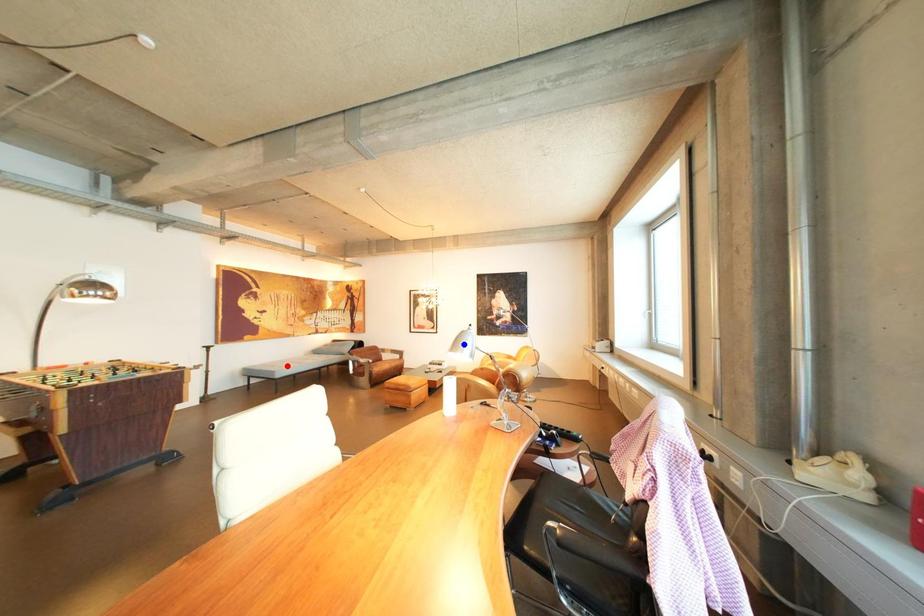
Question: In the image, two points are highlighted. Which point is nearer to the camera? Reply with the corresponding letter.

Choices:
 (A) blue point
 (B) red point

Answer: (A)